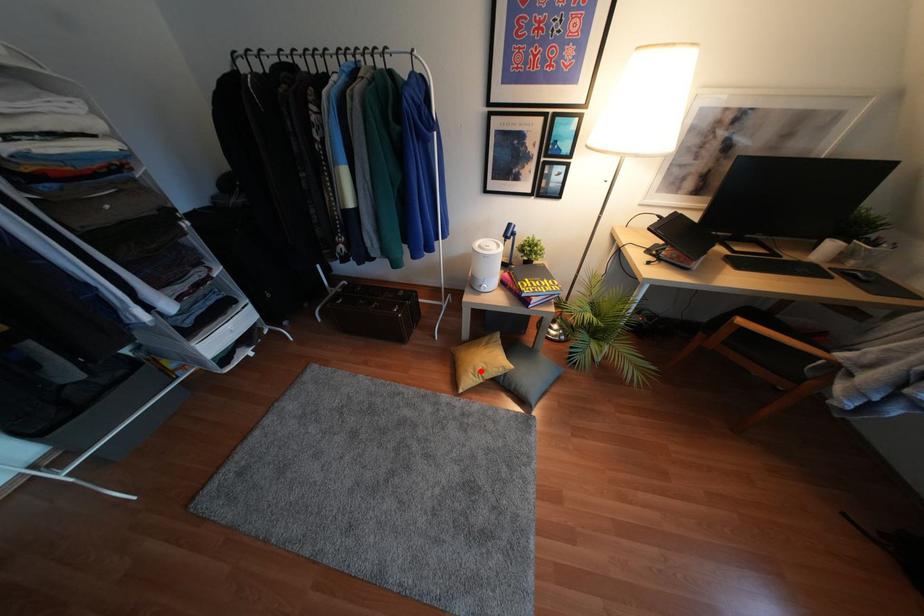
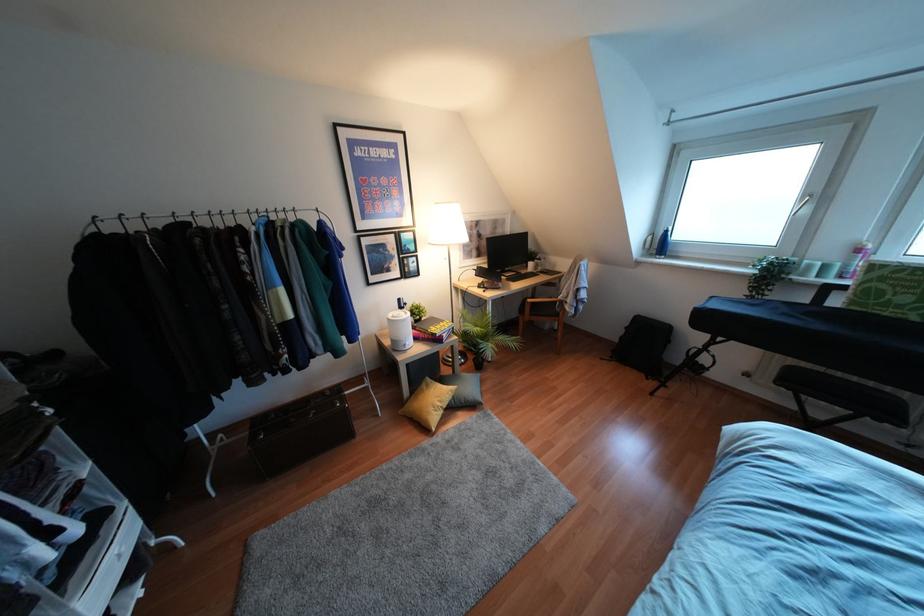
Locate, in the second image, the point that corresponds to the highlighted location in the first image.

(439, 403)